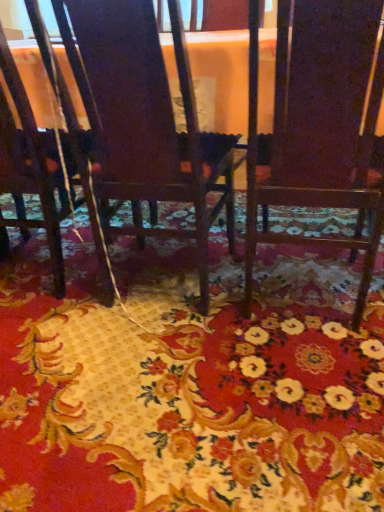
Question: In the image, is dark wood chair at center, acting as the second chair starting from the right, positioned in front of or behind floral carpet at center?

Choices:
 (A) front
 (B) behind

Answer: (B)

Question: In terms of width, does dark wood chair at center, arranged as the second chair when viewed from the left, look wider or thinner when compared to floral carpet at center?

Choices:
 (A) thin
 (B) wide

Answer: (A)

Question: Which of these objects is positioned closest to the matte dark wood chair at lower left, the third chair positioned from the right?

Choices:
 (A) dark wood chair at center, arranged as the second chair when viewed from the left
 (B) wooden chair at center, which is counted as the 3th chair, starting from the left
 (C) floral carpet at center

Answer: (A)

Question: Estimate the real-world distances between objects in this image. Which object is farther from the matte dark wood chair at lower left, the third chair positioned from the right?

Choices:
 (A) dark wood chair at center, acting as the second chair starting from the right
 (B) wooden chair at center, positioned as the first chair in right-to-left order
 (C) floral carpet at center

Answer: (B)